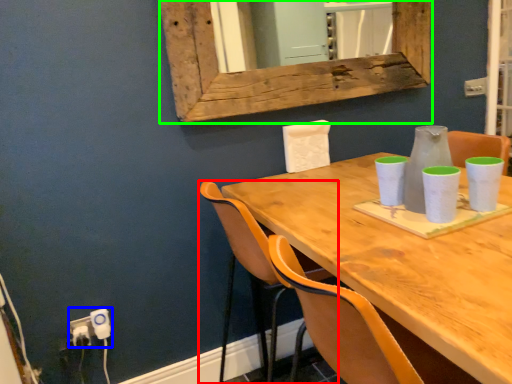
Question: Estimate the real-world distances between objects in this image. Which object is farther from chair (highlighted by a red box), electric outlet (highlighted by a blue box) or window frame (highlighted by a green box)?

Choices:
 (A) electric outlet
 (B) window frame

Answer: (A)